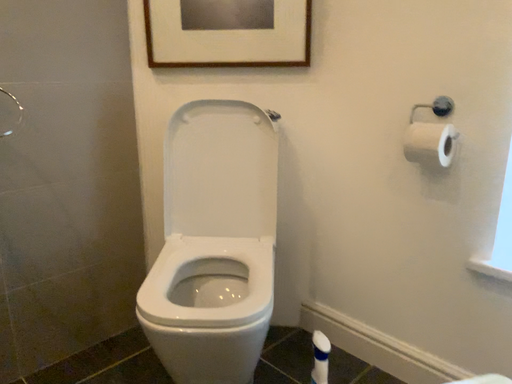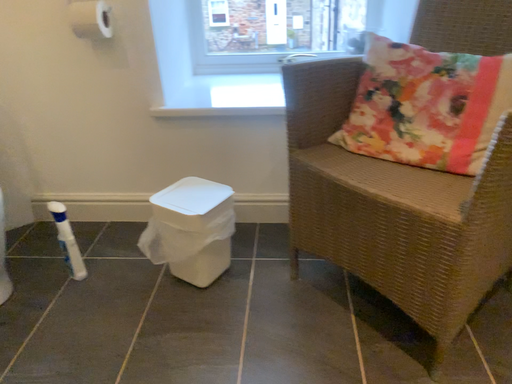
Question: How did the camera likely rotate when shooting the video?

Choices:
 (A) rotated left
 (B) rotated right

Answer: (B)